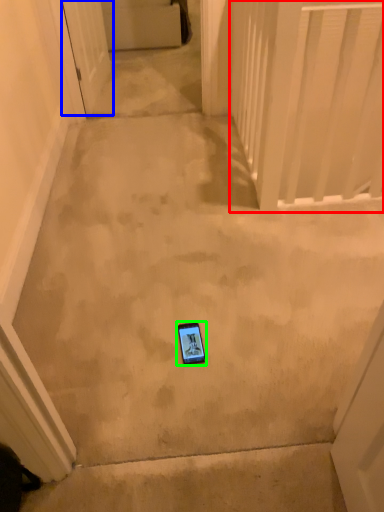
Question: Based on their relative distances, which object is farther from balustrade (highlighted by a red box)? Choose from door (highlighted by a blue box) and mobile phone (highlighted by a green box).

Choices:
 (A) door
 (B) mobile phone

Answer: (B)